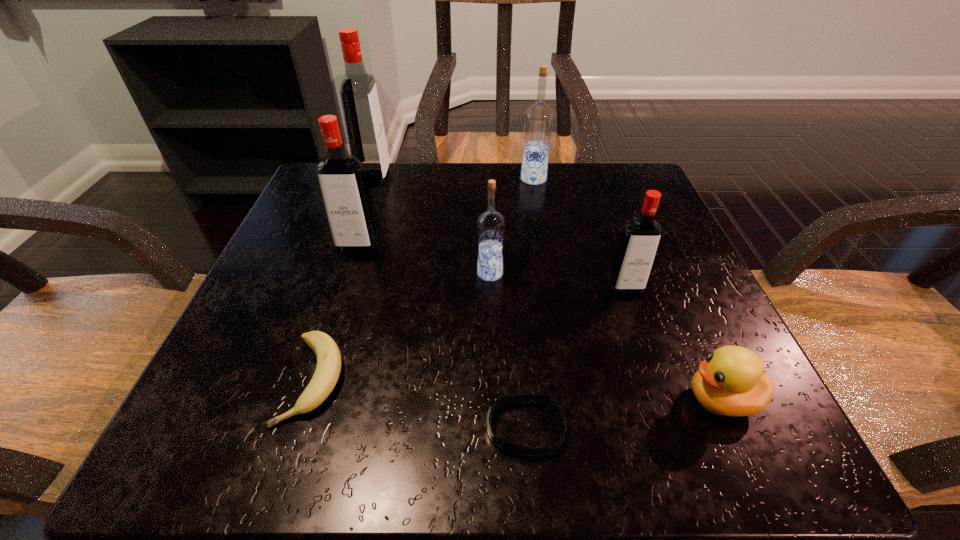
Where is `vodka positioned at the right edge`? The width and height of the screenshot is (960, 540). vodka positioned at the right edge is located at coordinates (640, 238).

This screenshot has height=540, width=960. Find the location of `duckling that is positioned at the right edge`. duckling that is positioned at the right edge is located at coordinates (731, 382).

Image resolution: width=960 pixels, height=540 pixels. I want to click on object that is positioned at the far left corner, so click(x=363, y=119).

This screenshot has height=540, width=960. What are the coordinates of `object that is at the near left corner` in the screenshot? It's located at (328, 368).

Locate an element on the screen. The height and width of the screenshot is (540, 960). object at the near right corner is located at coordinates (731, 382).

I want to click on vacant space at the far edge of the desktop, so click(x=487, y=163).

Locate an element on the screen. The image size is (960, 540). blank area at the near edge is located at coordinates (322, 404).

Find the location of `vacant space at the right edge of the desktop`. vacant space at the right edge of the desktop is located at coordinates (670, 250).

What are the coordinates of `blank space at the far right corner of the desktop` in the screenshot? It's located at (636, 211).

Find the location of a particular element. Image resolution: width=960 pixels, height=540 pixels. vacant area at the near right corner of the desktop is located at coordinates (698, 438).